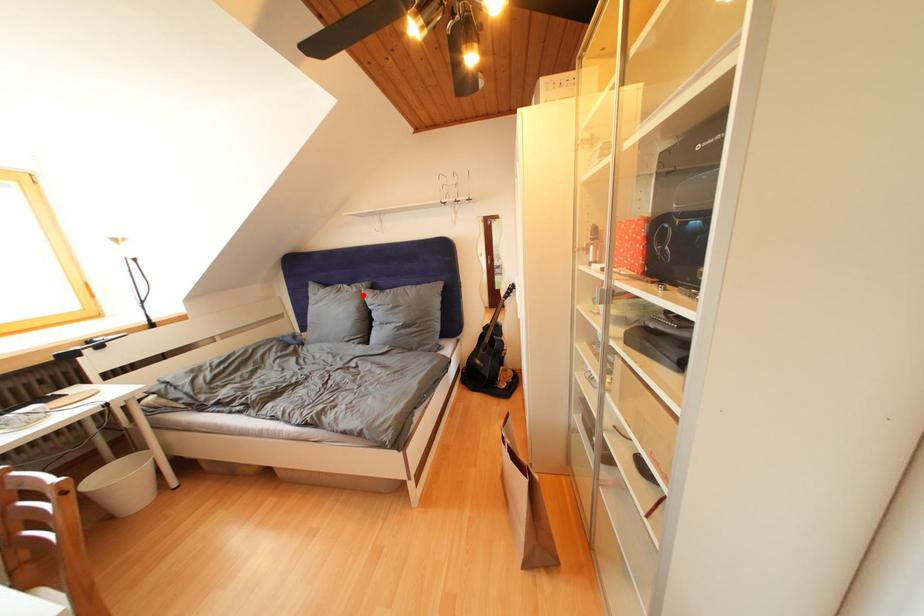
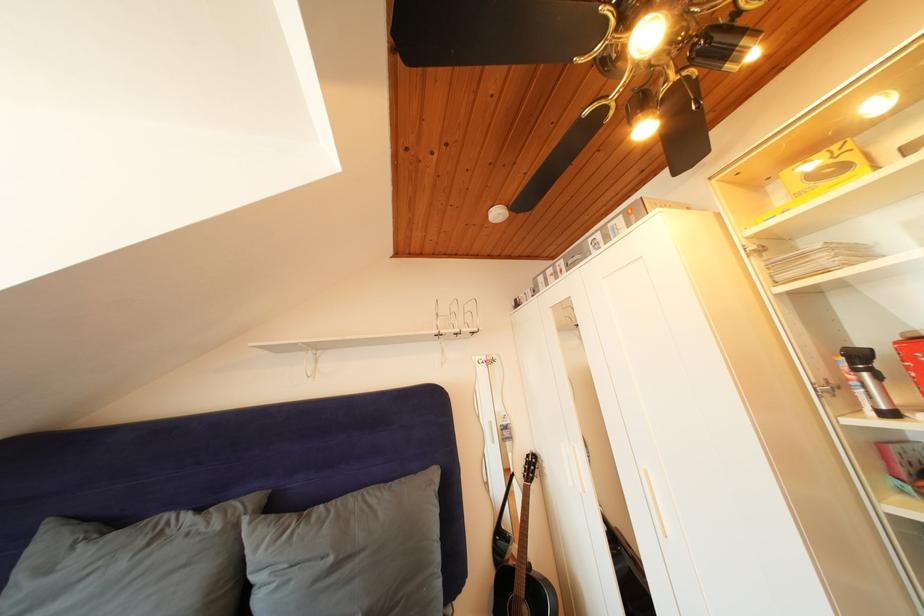
In the second image, find the point that corresponds to the highlighted location in the first image.

(225, 531)